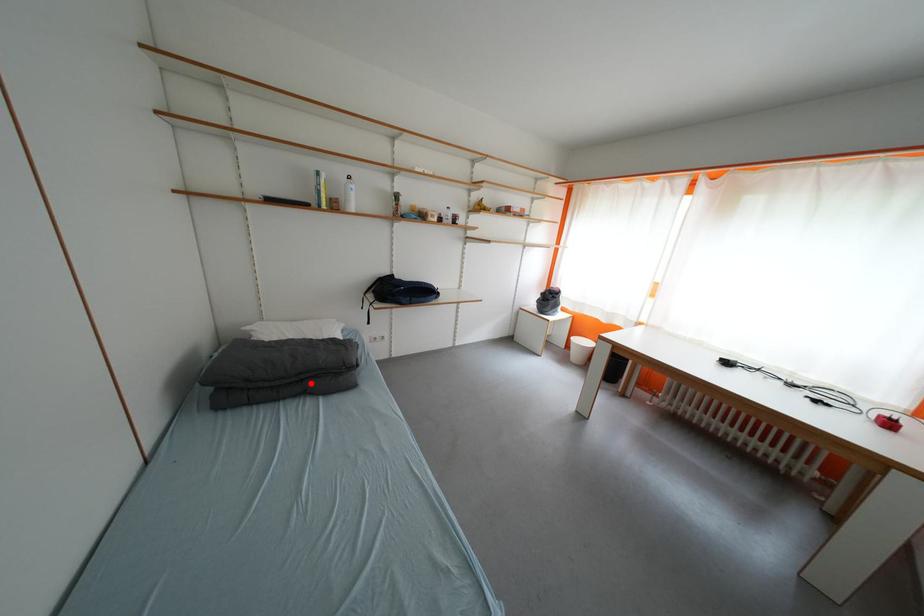
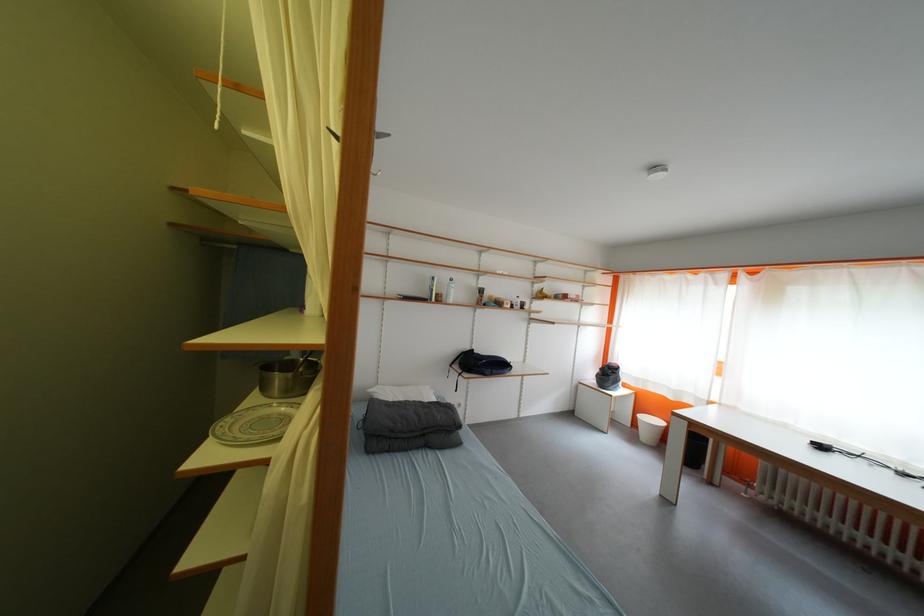
Question: I am providing you with two images of the same scene from different viewpoints. In image1, a red point is highlighted. Considering the same 3D point in image2, which of the following is correct?

Choices:
 (A) It is closer
 (B) It is farther

Answer: (B)